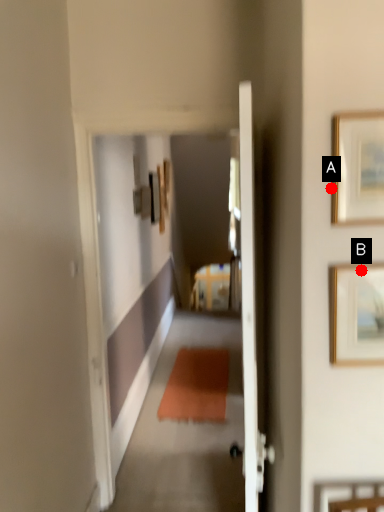
Question: Two points are circled on the image, labeled by A and B beside each circle. Which of the following is the closest to the observer?

Choices:
 (A) A is closer
 (B) B is closer

Answer: (A)